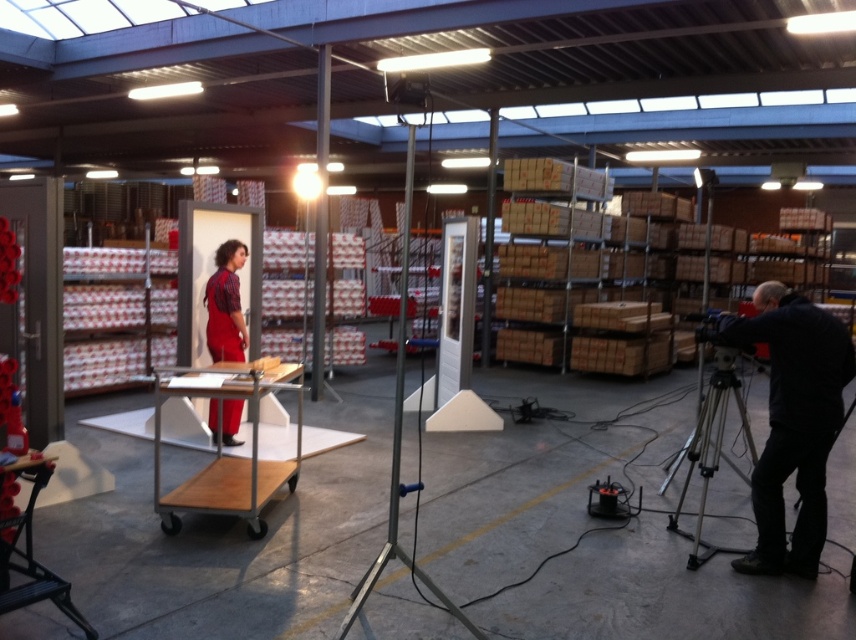
Looking at this image, you are standing at the center of the warehouse and want to place a new item at the position of the dark blue jacket at right. What are the coordinates where you should place the item?

The coordinates for the dark blue jacket at right are at point (792,420), so you should place the item at those coordinates.

You are a photographer setting up for a photoshoot in a warehouse. You have a camera on a tripod and a dark blue jacket at right. The photoshoot requires the jacket to be exactly 4 meters away from the camera. Can you confirm if the jacket is positioned correctly?

The dark blue jacket at right is currently 3.72 meters away from the camera, which is 0.28 meters shorter than the required 4 meters. To meet the requirement, you need to move the jacket approximately 0.28 meters farther away from the camera.